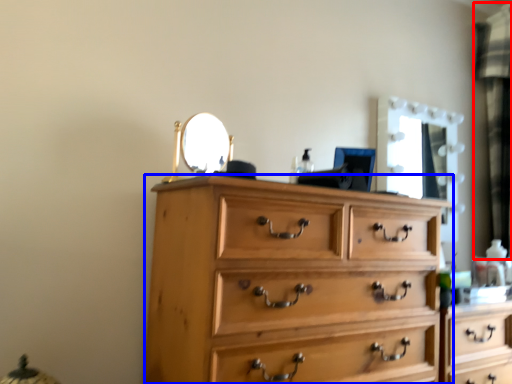
Question: Which of the following is the farthest to the observer, curtain (highlighted by a red box) or chest of drawers (highlighted by a blue box)?

Choices:
 (A) curtain
 (B) chest of drawers

Answer: (A)